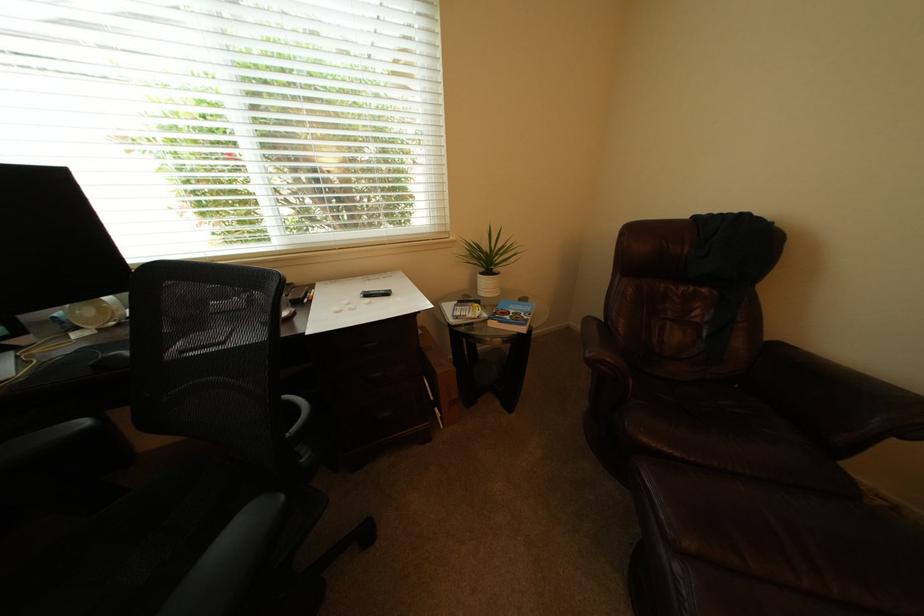
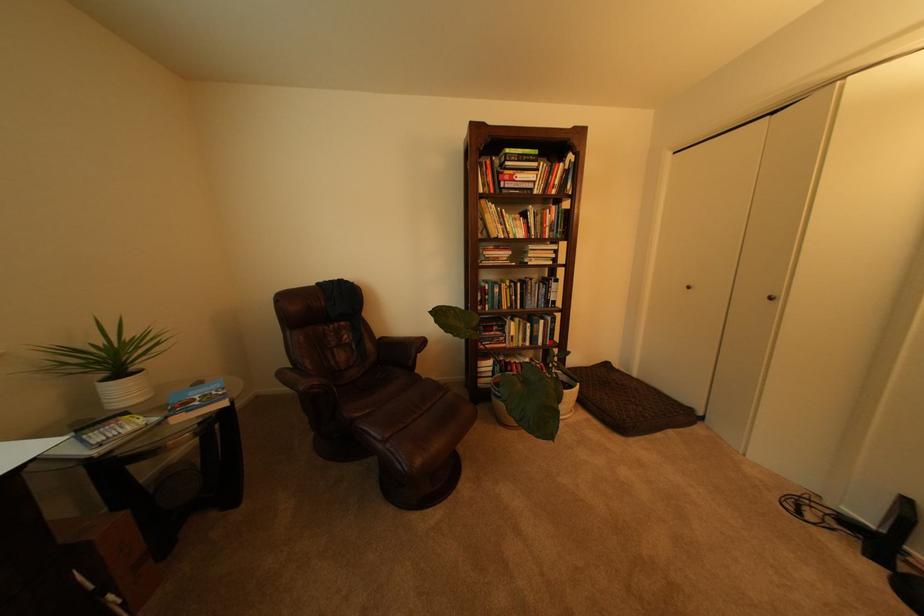
Where in the second image is the point corresponding to the point at 533,315 from the first image?

(225, 395)